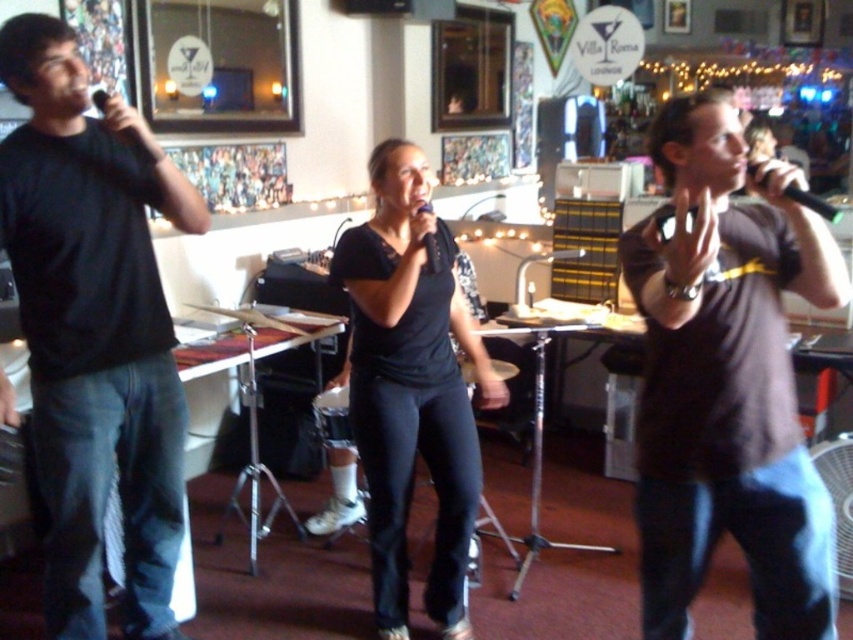
Looking at this image, between black matte shirt at center and black matte microphone at center, which one is positioned higher?

black matte microphone at center is above.

Is point (405, 468) farther from viewer compared to point (431, 268)?

No, it is not.

Who is more forward, (410,291) or (432,260)?

Point (410,291) is in front.

Locate an element on the screen. The width and height of the screenshot is (853, 640). black matte shirt at center is located at coordinates (410, 388).

Who is lower down, brown matte t-shirt at center or black matte shirt at center?

black matte shirt at center

Does brown matte t-shirt at center have a larger size compared to black matte shirt at center?

Correct, brown matte t-shirt at center is larger in size than black matte shirt at center.

Measure the distance between brown matte t-shirt at center and camera.

brown matte t-shirt at center is 4.98 feet from camera.

Where is `brown matte t-shirt at center`? Image resolution: width=853 pixels, height=640 pixels. brown matte t-shirt at center is located at coordinates (727, 380).

Identify the location of matte black shirt at center. (682, 289).

Is matte black shirt at center to the left of matte black microphone at upper left from the viewer's perspective?

Incorrect, matte black shirt at center is not on the left side of matte black microphone at upper left.

This screenshot has height=640, width=853. I want to click on matte black shirt at center, so click(x=682, y=289).